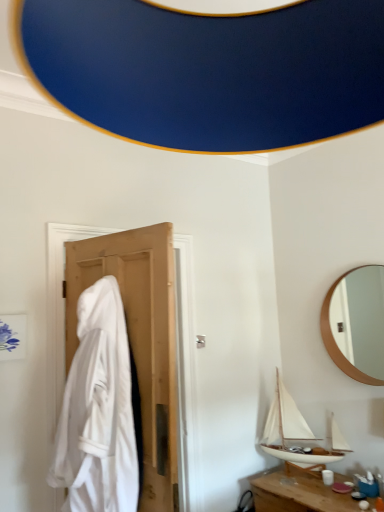
Question: Is wooden table at lower right looking in the opposite direction of wooden round mirror at upper right?

Choices:
 (A) yes
 (B) no

Answer: (B)

Question: Is wooden table at lower right facing towards wooden round mirror at upper right?

Choices:
 (A) yes
 (B) no

Answer: (B)

Question: Is wooden table at lower right shorter than wooden round mirror at upper right?

Choices:
 (A) yes
 (B) no

Answer: (A)

Question: Is wooden table at lower right thinner than wooden round mirror at upper right?

Choices:
 (A) yes
 (B) no

Answer: (B)

Question: Is wooden table at lower right to the right of wooden round mirror at upper right from the viewer's perspective?

Choices:
 (A) yes
 (B) no

Answer: (B)

Question: From a real-world perspective, is white wood boat at lower right positioned above or below wooden table at lower right?

Choices:
 (A) below
 (B) above

Answer: (B)

Question: From the image's perspective, is white wood boat at lower right positioned above or below wooden table at lower right?

Choices:
 (A) below
 (B) above

Answer: (B)

Question: Is point (278, 391) positioned closer to the camera than point (314, 504)?

Choices:
 (A) farther
 (B) closer

Answer: (A)

Question: In terms of width, does white wood boat at lower right look wider or thinner when compared to wooden table at lower right?

Choices:
 (A) thin
 (B) wide

Answer: (A)

Question: From the image's perspective, is wooden round mirror at upper right above or below white fabric at left?

Choices:
 (A) above
 (B) below

Answer: (A)

Question: Is wooden round mirror at upper right bigger or smaller than white fabric at left?

Choices:
 (A) small
 (B) big

Answer: (A)

Question: Is wooden round mirror at upper right taller or shorter than white fabric at left?

Choices:
 (A) short
 (B) tall

Answer: (A)

Question: Does point (369, 314) appear closer or farther from the camera than point (94, 245)?

Choices:
 (A) farther
 (B) closer

Answer: (A)

Question: Looking at the image, does wooden table at lower right seem bigger or smaller compared to white wood boat at lower right?

Choices:
 (A) small
 (B) big

Answer: (B)

Question: From their relative heights in the image, would you say wooden table at lower right is taller or shorter than white wood boat at lower right?

Choices:
 (A) short
 (B) tall

Answer: (A)